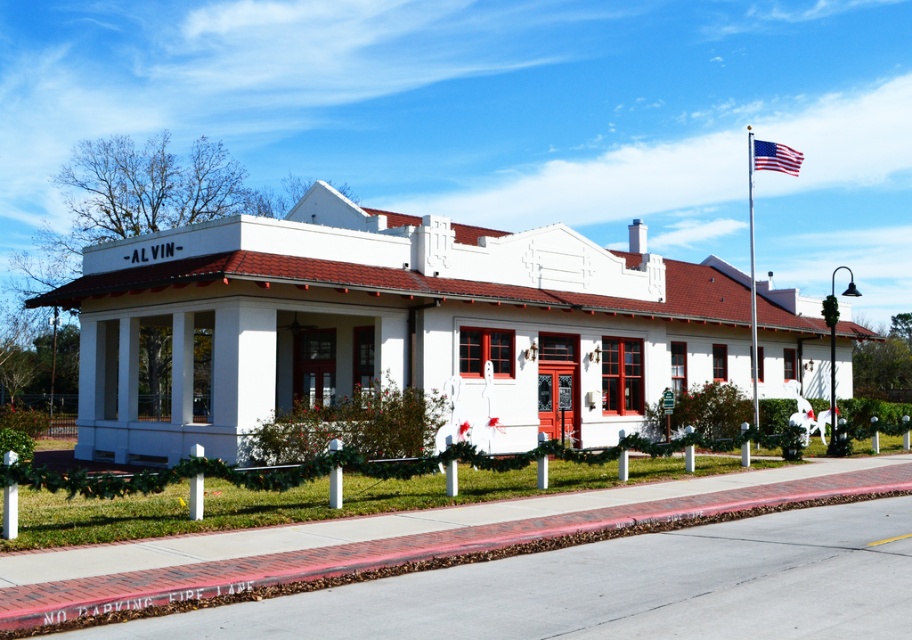
Which is more to the left, brick at lower center or metallic flag pole at center?

Positioned to the left is brick at lower center.

The height and width of the screenshot is (640, 912). I want to click on brick at lower center, so click(403, 550).

Find the location of `brick at lower center`. brick at lower center is located at coordinates (403, 550).

Does brick at lower center have a lesser height compared to american flag at upper right?

Yes, brick at lower center is shorter than american flag at upper right.

Is brick at lower center above american flag at upper right?

Actually, brick at lower center is below american flag at upper right.

This screenshot has width=912, height=640. What are the coordinates of `brick at lower center` in the screenshot? It's located at (403, 550).

Identify the location of brick at lower center. (x=403, y=550).

Who is more forward, (755, 330) or (781, 148)?

Positioned in front is point (781, 148).

Who is more distant from viewer, (748,152) or (774,156)?

The point (748,152) is more distant.

Identify the location of metallic flag pole at center. This screenshot has width=912, height=640. (752, 282).